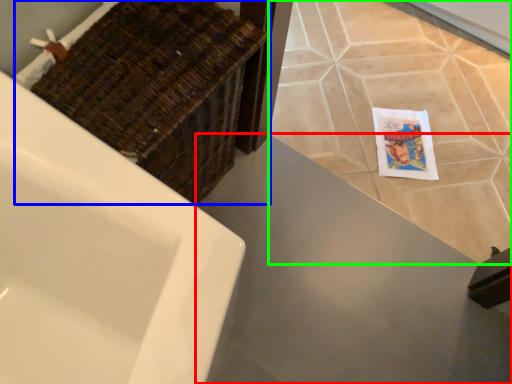
Question: Considering the real-world distances, which object is closest to counter top (highlighted by a red box)? basket (highlighted by a blue box) or ceramic tile (highlighted by a green box).

Choices:
 (A) basket
 (B) ceramic tile

Answer: (B)